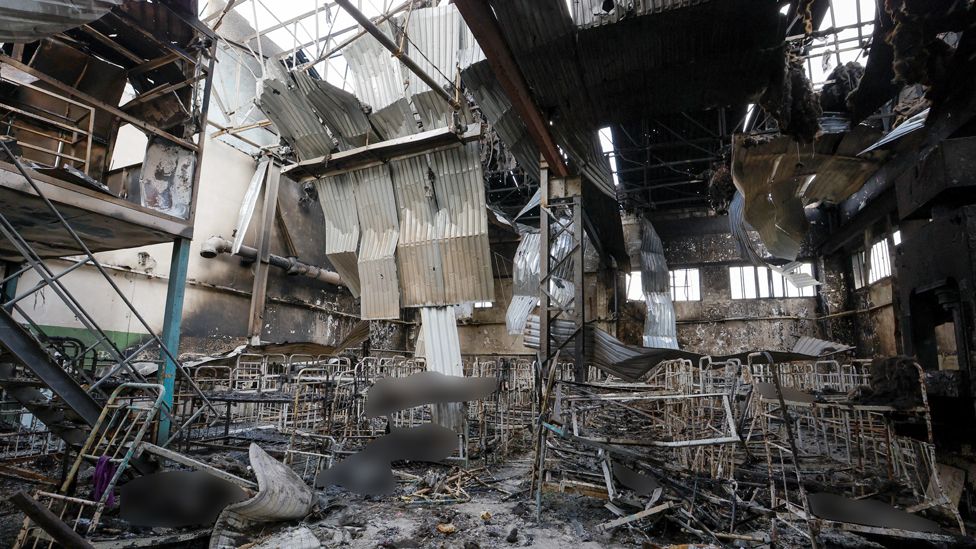
Where is `white wall`? white wall is located at coordinates (101, 301), (218, 182), (297, 322).